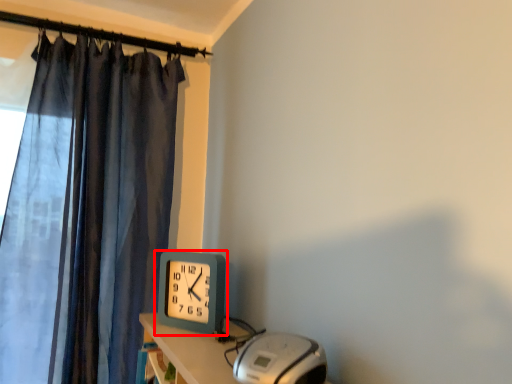
Question: From the image's perspective, considering the relative positions of wall clock (annotated by the red box) and equipment in the image provided, where is wall clock (annotated by the red box) located with respect to the staircase?

Choices:
 (A) above
 (B) below

Answer: (A)